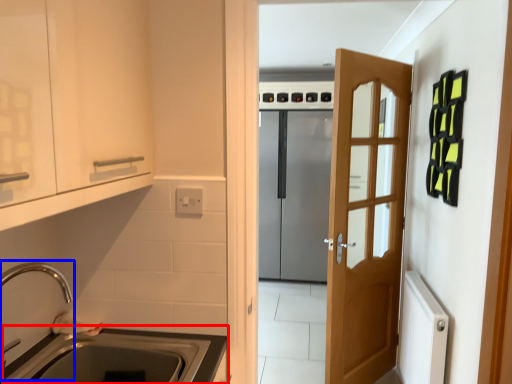
Question: Which object is further to the camera taking this photo, counter top (highlighted by a red box) or faucet (highlighted by a blue box)?

Choices:
 (A) counter top
 (B) faucet

Answer: (A)